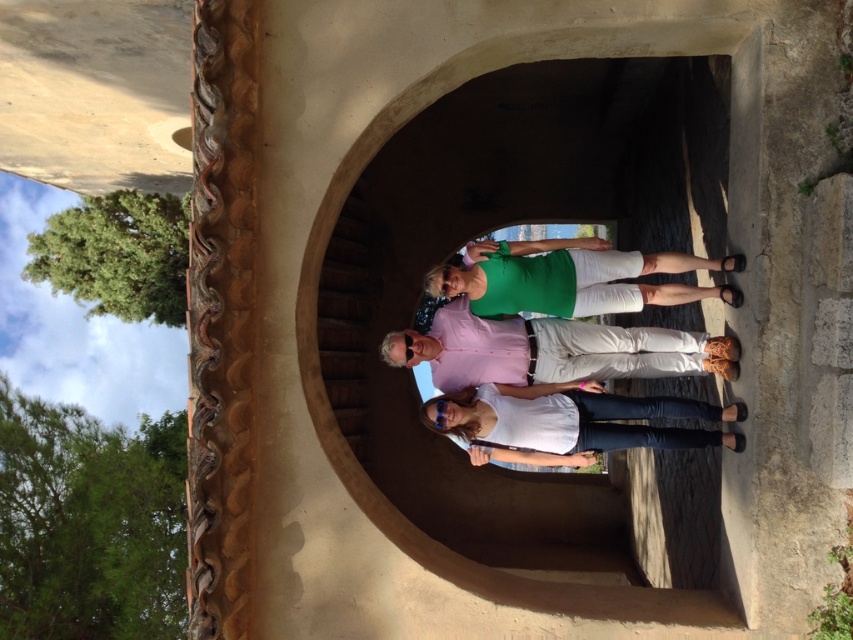
Who is taller, smooth stone archway at center or white matte shirt at center?

With more height is white matte shirt at center.

Which is below, smooth stone archway at center or white matte shirt at center?

white matte shirt at center is lower down.

You are a GUI agent. You are given a task and a screenshot of the screen. Output one action in this format:
    pyautogui.click(x=<x>, y=<y>)
    Task: Click on the smooth stone archway at center
    This screenshot has width=853, height=640.
    Given the screenshot: What is the action you would take?
    pyautogui.click(x=492, y=228)

Image resolution: width=853 pixels, height=640 pixels. I want to click on smooth stone archway at center, so click(x=492, y=228).

Which is more to the left, smooth stone archway at center or green matte shorts at center?

From the viewer's perspective, green matte shorts at center appears more on the left side.

From the picture: Can you confirm if smooth stone archway at center is thinner than green matte shorts at center?

Yes.

What are the coordinates of `smooth stone archway at center` in the screenshot? It's located at (492, 228).

You are a GUI agent. You are given a task and a screenshot of the screen. Output one action in this format:
    pyautogui.click(x=<x>, y=<y>)
    Task: Click on the smooth stone archway at center
    
    Given the screenshot: What is the action you would take?
    pyautogui.click(x=492, y=228)

Based on the photo, is smooth stone archway at center below white cotton pants at center?

Actually, smooth stone archway at center is above white cotton pants at center.

Which is more to the right, smooth stone archway at center or white cotton pants at center?

From the viewer's perspective, smooth stone archway at center appears more on the right side.

Which is behind, point (537, 508) or point (587, 378)?

Positioned behind is point (537, 508).

At what (x,y) coordinates should I click in order to perform the action: click on smooth stone archway at center. Please return your answer as a coordinate pair (x, y). Looking at the image, I should click on (492, 228).